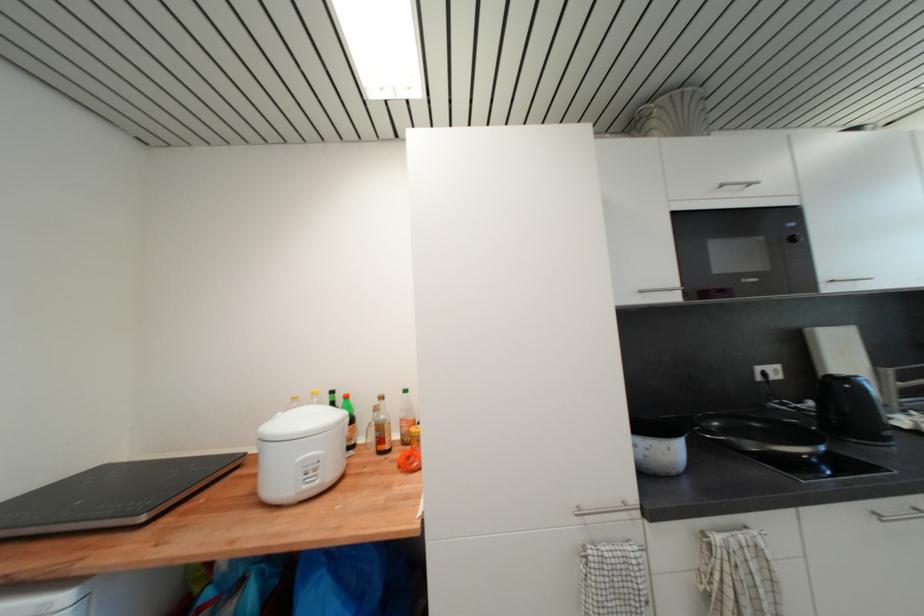
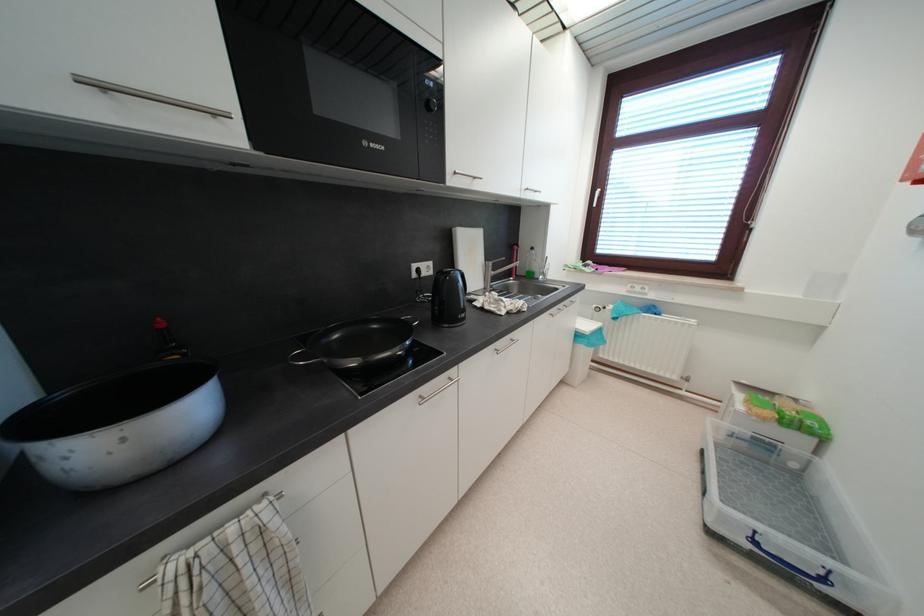
The point at (883, 366) is marked in the first image. Where is the corresponding point in the second image?

(492, 261)